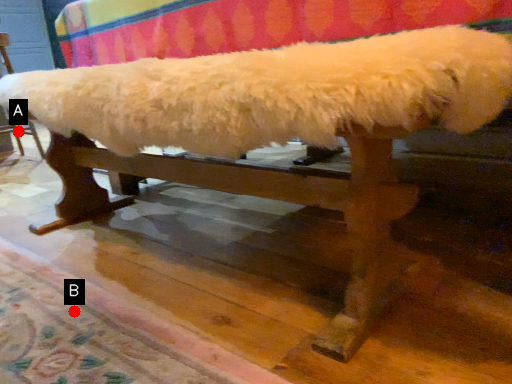
Question: Two points are circled on the image, labeled by A and B beside each circle. Among these points, which one is farthest from the camera?

Choices:
 (A) A is further
 (B) B is further

Answer: (A)